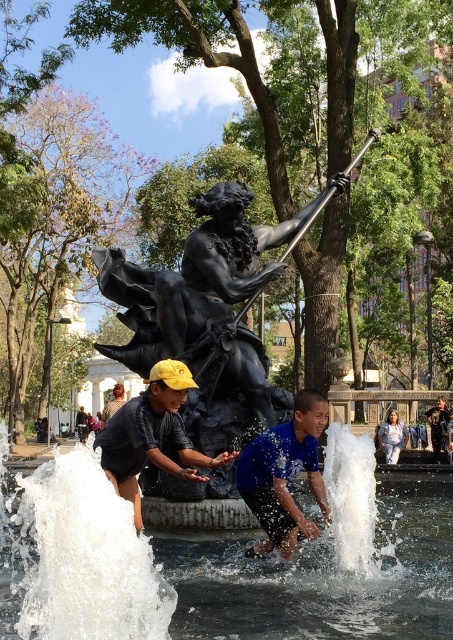
Who is lower down, black polished statue at center or blue matte shirt at center?

blue matte shirt at center

Consider the image. Does black polished statue at center lie in front of blue matte shirt at center?

No, it is behind blue matte shirt at center.

Is point (186, 323) positioned in front of point (270, 442)?

No.

Identify the location of black polished statue at center. The image size is (453, 640). (208, 314).

Does clear water at fountain center appear on the right side of black polished statue at center?

Yes, clear water at fountain center is to the right of black polished statue at center.

Between point (338, 554) and point (227, 392), which one is positioned in front?

Point (338, 554) is more forward.

Image resolution: width=453 pixels, height=640 pixels. Find the location of `clear water at fountain center`. clear water at fountain center is located at coordinates (221, 566).

Is matte black statue at center bigger than blue matte shirt at center?

Correct, matte black statue at center is larger in size than blue matte shirt at center.

Can you confirm if matte black statue at center is smaller than blue matte shirt at center?

No.

Which is in front, point (182, 461) or point (299, 428)?

Point (299, 428) is more forward.

The height and width of the screenshot is (640, 453). Identify the location of matte black statue at center. (153, 435).